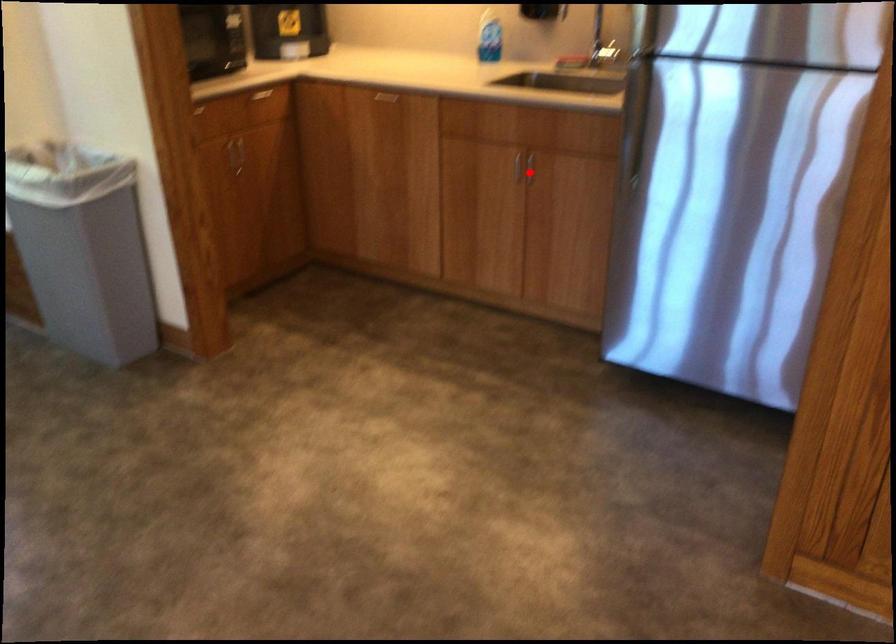
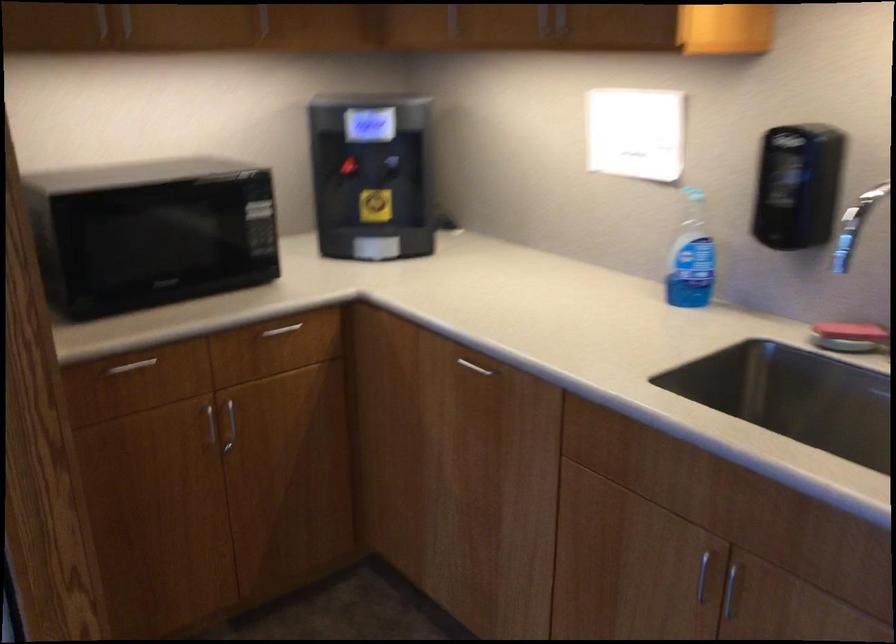
Find the pixel in the second image that matches the highlighted location in the first image.

(729, 590)